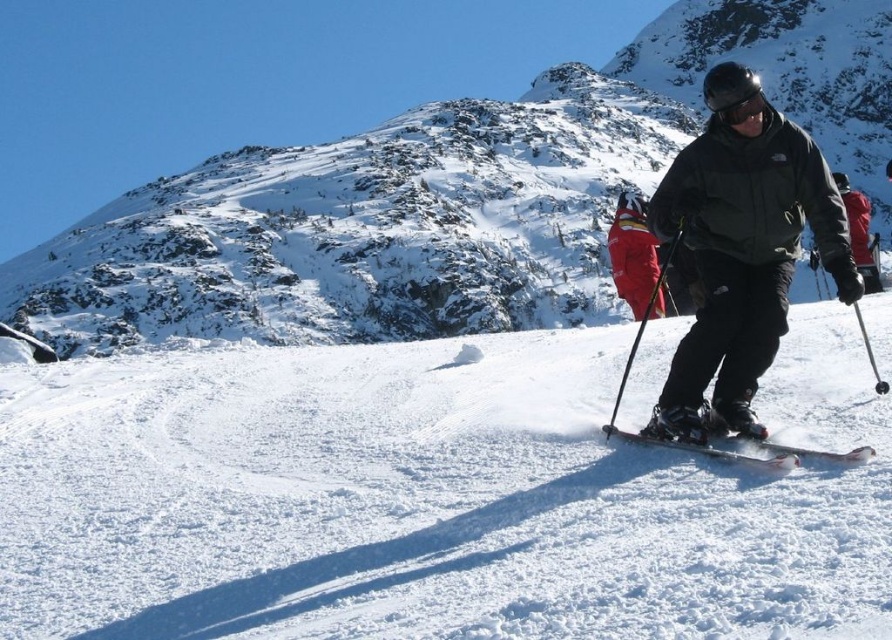
Question: Estimate the real-world distances between objects in this image. Which object is closer to the white matte skis at center?

Choices:
 (A) black matte goggles at center
 (B) snowy rocky mountain at upper center

Answer: (A)

Question: Is white powder snow at center to the right of snowy rocky mountain at upper center from the viewer's perspective?

Choices:
 (A) yes
 (B) no

Answer: (B)

Question: Which point is farther from the camera taking this photo?

Choices:
 (A) (771, 460)
 (B) (734, 154)
 (C) (818, 420)
 (D) (871, 93)

Answer: (D)

Question: Which of the following is the closest to the observer?

Choices:
 (A) black matte goggles at center
 (B) white matte skis at center
 (C) dark green matte jacket at center right
 (D) snowy rocky mountain at upper center

Answer: (B)

Question: Is dark green matte jacket at center right below black plastic ski pole at center?

Choices:
 (A) yes
 (B) no

Answer: (A)

Question: Does white matte skis at center have a smaller size compared to black plastic ski pole at center?

Choices:
 (A) no
 (B) yes

Answer: (B)